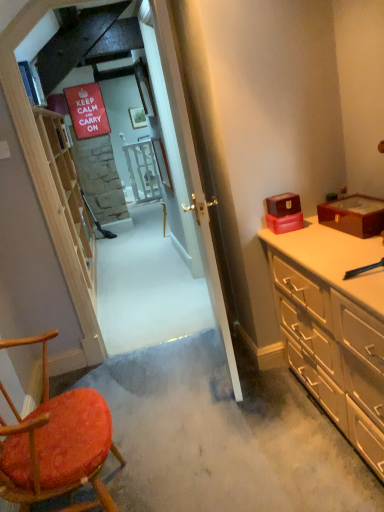
Identify the location of vacant space to the left of shiny burgundy box at right, acting as the 1th box starting from the right. This screenshot has width=384, height=512. (310, 240).